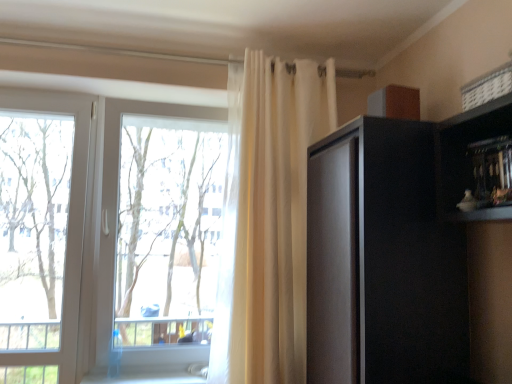
The image size is (512, 384). What do you see at coordinates (382, 261) in the screenshot? I see `matte black cabinet at right` at bounding box center [382, 261].

Find the location of a particular element. The image size is (512, 384). sheer white curtain at upper center is located at coordinates (275, 215).

The height and width of the screenshot is (384, 512). What are the coordinates of `transparent glass tree at left` in the screenshot? It's located at (33, 214).

From a real-world perspective, between sheer white curtain at upper center and transparent glass window at center, who is vertically higher?

In real-world perspective, sheer white curtain at upper center is above.

How many degrees apart are the facing directions of sheer white curtain at upper center and transparent glass window at center?

sheer white curtain at upper center and transparent glass window at center are facing 0.767 degrees away from each other.

Considering the positions of objects sheer white curtain at upper center and transparent glass window at center in the image provided, who is behind, sheer white curtain at upper center or transparent glass window at center?

Positioned behind is transparent glass window at center.

Considering the relative sizes of sheer white curtain at upper center and transparent glass window at center in the image provided, is sheer white curtain at upper center shorter than transparent glass window at center?

Incorrect, the height of sheer white curtain at upper center does not fall short of that of transparent glass window at center.

Is transparent glass window at center with matte black cabinet at right?

transparent glass window at center and matte black cabinet at right are not in contact.

Is transparent glass window at center behind matte black cabinet at right?

Yes, the depth of transparent glass window at center is greater than that of matte black cabinet at right.

Is transparent glass window at center taller or shorter than matte black cabinet at right?

In the image, transparent glass window at center appears to be taller than matte black cabinet at right.

Does transparent glass tree at left appear on the left side of transparent glass window at center?

Indeed, transparent glass tree at left is positioned on the left side of transparent glass window at center.

Does transparent glass tree at left have a larger size compared to transparent glass window at center?

No, transparent glass tree at left is not bigger than transparent glass window at center.

Considering the relative sizes of transparent glass tree at left and transparent glass window at center in the image provided, is transparent glass tree at left thinner than transparent glass window at center?

Yes, transparent glass tree at left is thinner than transparent glass window at center.

From the image's perspective, would you say matte black cabinet at right is positioned over sheer white curtain at upper center?

No.

Does matte black cabinet at right have a larger size compared to sheer white curtain at upper center?

No.

Could sheer white curtain at upper center be considered to be inside matte black cabinet at right?

Actually, sheer white curtain at upper center is outside matte black cabinet at right.

Are matte black cabinet at right and sheer white curtain at upper center far apart?

No, matte black cabinet at right is not far from sheer white curtain at upper center.

Can you tell me how much matte black cabinet at right and transparent glass window at center differ in facing direction?

There is a 89-degree angle between the facing directions of matte black cabinet at right and transparent glass window at center.

Looking at this image, which object is thinner, matte black cabinet at right or transparent glass window at center?

transparent glass window at center is thinner.

Considering the relative positions of matte black cabinet at right and transparent glass window at center in the image provided, is matte black cabinet at right to the right of transparent glass window at center from the viewer's perspective?

Correct, you'll find matte black cabinet at right to the right of transparent glass window at center.

Is matte black cabinet at right turned away from transparent glass window at center?

No, matte black cabinet at right is not facing away from transparent glass window at center.

Is transparent glass window at center completely or partially outside of sheer white curtain at upper center?

Yes, transparent glass window at center is located beyond the bounds of sheer white curtain at upper center.

Between transparent glass window at center and sheer white curtain at upper center, which one has smaller size?

With smaller size is transparent glass window at center.

Considering the sizes of transparent glass window at center and sheer white curtain at upper center in the image, is transparent glass window at center taller or shorter than sheer white curtain at upper center?

In the image, transparent glass window at center appears to be shorter than sheer white curtain at upper center.

Which object is wider, transparent glass window at center or sheer white curtain at upper center?

sheer white curtain at upper center is wider.

Is transparent glass window at center turned away from transparent glass tree at left?

transparent glass window at center does not have its back to transparent glass tree at left.

Which is more to the left, transparent glass window at center or transparent glass tree at left?

transparent glass tree at left.

You are a GUI agent. You are given a task and a screenshot of the screen. Output one action in this format:
    pyautogui.click(x=<x>, y=<y>)
    Task: Click on the tree behind the transparent glass window at center
    This screenshot has height=384, width=512.
    Given the screenshot: What is the action you would take?
    pyautogui.click(x=33, y=214)

Between transparent glass window at center and transparent glass tree at left, which one has smaller size?

Smaller between the two is transparent glass tree at left.

Locate an element on the screen. The width and height of the screenshot is (512, 384). window behind the sheer white curtain at upper center is located at coordinates (62, 227).

Where is `window above the matte black cabinet at right (from a real-world perspective)`? This screenshot has height=384, width=512. window above the matte black cabinet at right (from a real-world perspective) is located at coordinates (62, 227).

From the image, which object appears to be nearer to transparent glass tree at left, matte black cabinet at right or sheer white curtain at upper center?

sheer white curtain at upper center lies closer to transparent glass tree at left than the other object.

Considering their positions, is matte black cabinet at right positioned further to sheer white curtain at upper center than transparent glass window at center?

transparent glass window at center is positioned further to the anchor sheer white curtain at upper center.

Which object lies further to the anchor point sheer white curtain at upper center, matte black cabinet at right or transparent glass tree at left?

transparent glass tree at left is positioned further to the anchor sheer white curtain at upper center.

Consider the image. Considering their positions, is sheer white curtain at upper center positioned further to transparent glass tree at left than matte black cabinet at right?

matte black cabinet at right is further to transparent glass tree at left.

From the image, which object appears to be nearer to transparent glass tree at left, sheer white curtain at upper center or transparent glass window at center?

transparent glass window at center.

Based on their spatial positions, is sheer white curtain at upper center or transparent glass tree at left closer to matte black cabinet at right?

sheer white curtain at upper center is closer to matte black cabinet at right.

Estimate the real-world distances between objects in this image. Which object is closer to sheer white curtain at upper center, transparent glass window at center or matte black cabinet at right?

matte black cabinet at right lies closer to sheer white curtain at upper center than the other object.

From the image, which object appears to be nearer to matte black cabinet at right, transparent glass window at center or transparent glass tree at left?

transparent glass window at center.

Where is `window between transparent glass tree at left and matte black cabinet at right in the horizontal direction`? window between transparent glass tree at left and matte black cabinet at right in the horizontal direction is located at coordinates (62, 227).

Where is `window between transparent glass tree at left and sheer white curtain at upper center in the horizontal direction`? This screenshot has width=512, height=384. window between transparent glass tree at left and sheer white curtain at upper center in the horizontal direction is located at coordinates (62, 227).

You are a GUI agent. You are given a task and a screenshot of the screen. Output one action in this format:
    pyautogui.click(x=<x>, y=<y>)
    Task: Click on the curtain between transparent glass window at center and matte black cabinet at right
    This screenshot has width=512, height=384.
    Given the screenshot: What is the action you would take?
    pyautogui.click(x=275, y=215)

Identify the location of curtain situated between transparent glass tree at left and matte black cabinet at right from left to right. The height and width of the screenshot is (384, 512). click(275, 215).